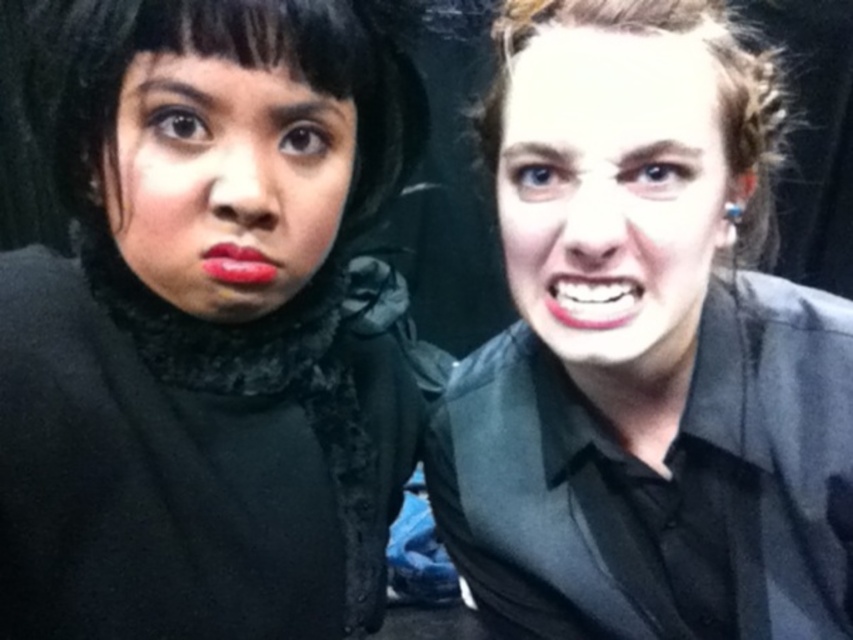
You are a photographer trying to adjust the lighting for a photo shoot. You notice two faces in the frame. The smooth skin face at right and the matte black face at upper left. Which face is positioned lower in the image?

The smooth skin face at right is positioned lower than the matte black face at upper left.

You are a photographer adjusting the lighting in the studio. You notice a point at coordinates [225,180] on the image. Based on the scene description, what does this point likely represent?

The point at coordinates [225,180] marks the matte black face at upper left, which is part of the person on the left with dark hair and a black outfit.